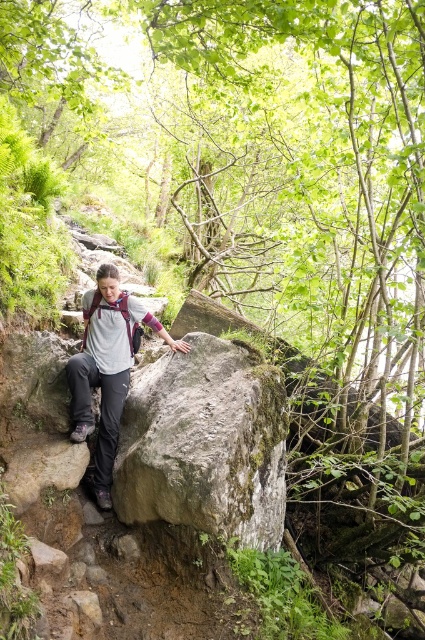
Does green mossy rock at center appear over matte gray shirt at center?

No, green mossy rock at center is not above matte gray shirt at center.

Can you confirm if green mossy rock at center is positioned below matte gray shirt at center?

Correct, green mossy rock at center is located below matte gray shirt at center.

Is point (278, 512) positioned after point (99, 422)?

No.

Locate an element on the screen. The height and width of the screenshot is (640, 425). green mossy rock at center is located at coordinates (206, 444).